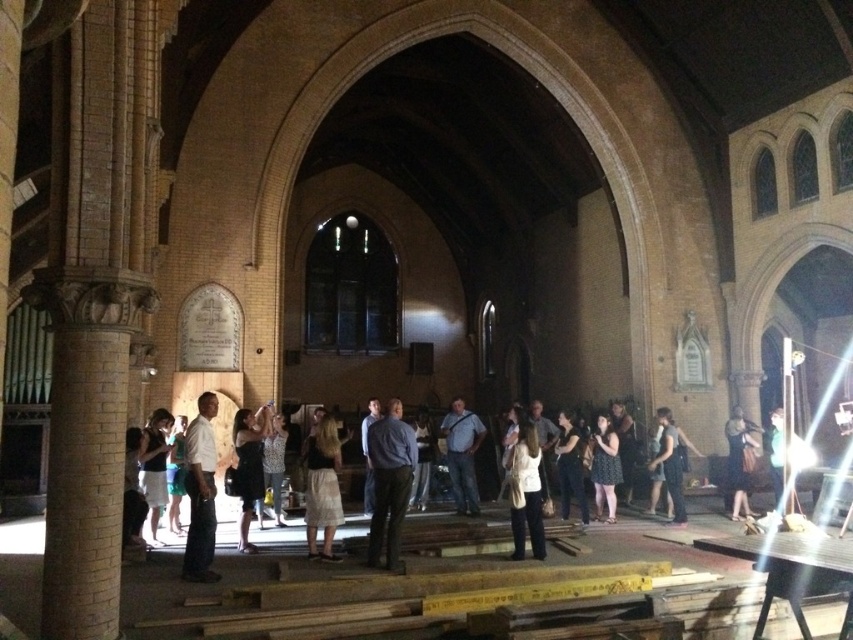
Question: Can you confirm if sparkly silver dress at center is bigger than blue shirt at center?

Choices:
 (A) yes
 (B) no

Answer: (B)

Question: From the image, what is the correct spatial relationship of white shirt at center in relation to dark gray fabric dress at center?

Choices:
 (A) above
 (B) below

Answer: (A)

Question: Which is nearer to the dark blue dress at center?

Choices:
 (A) matte black dress at center
 (B) dark gray dress at center

Answer: (A)

Question: Is denim shirt at center smaller than green fabric shirt at center?

Choices:
 (A) no
 (B) yes

Answer: (B)

Question: Which of these objects is positioned farthest from the dark gray fabric dress at center?

Choices:
 (A) dark blue shirt at center
 (B) light beige skirt at center
 (C) sparkly silver dress at center

Answer: (C)

Question: Which object appears farthest from the camera in this image?

Choices:
 (A) denim shirt at center
 (B) matte black dress at center

Answer: (A)